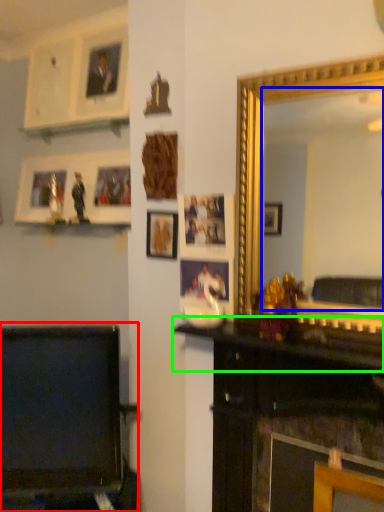
Question: Which object is the farthest from furniture (highlighted by a red box)? Choose among these: mirror (highlighted by a blue box) or mantle (highlighted by a green box).

Choices:
 (A) mirror
 (B) mantle

Answer: (A)